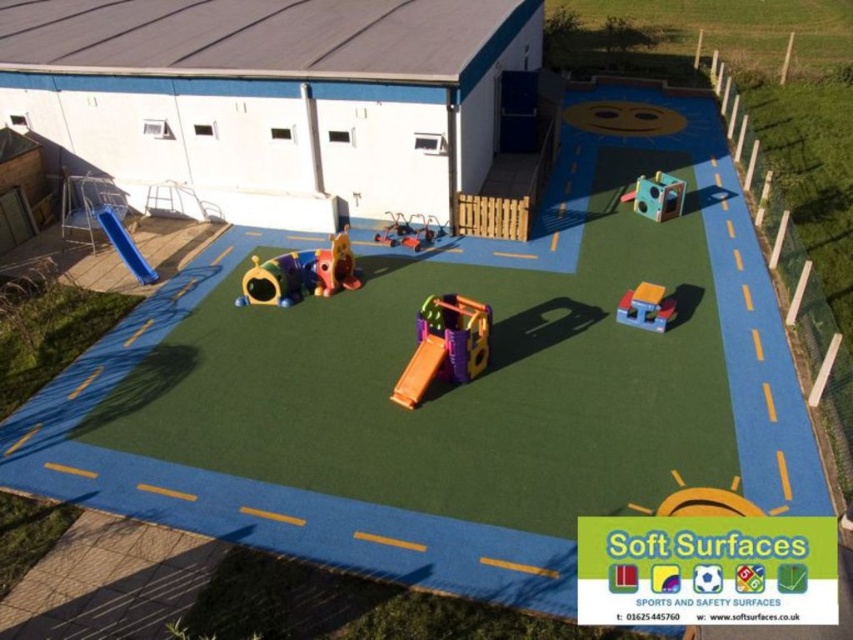
Question: Does matte yellow tunnel at center appear on the right side of rubberized plastic slide at center?

Choices:
 (A) no
 (B) yes

Answer: (A)

Question: Can you confirm if orange plastic slide at center is thinner than rubberized plastic playhouse at center?

Choices:
 (A) yes
 (B) no

Answer: (A)

Question: Which of the following is the closest to the observer?

Choices:
 (A) (x=318, y=282)
 (B) (x=665, y=196)

Answer: (A)

Question: Is matte multicolored cube at upper right positioned behind rubberized yellow slide at center?

Choices:
 (A) no
 (B) yes

Answer: (B)

Question: Which of these objects is positioned farthest from the orange matte slide at center?

Choices:
 (A) blue rubber slide at upper left
 (B) matte multicolored cube at upper right
 (C) rubberized plastic playhouse at center

Answer: (B)

Question: Which object appears closest to the camera in this image?

Choices:
 (A) matte yellow tunnel at center
 (B) orange matte slide at center
 (C) orange plastic slide at center
 (D) rubberized multicolored play structure at center-left

Answer: (C)